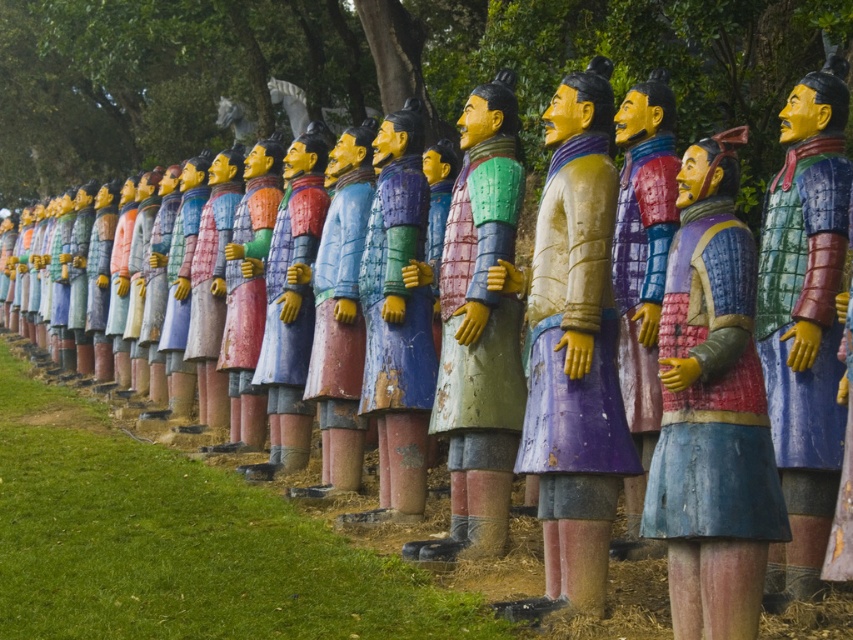
Is wooden figure at center to the left of wooden armor figure at center from the viewer's perspective?

Indeed, wooden figure at center is positioned on the left side of wooden armor figure at center.

Is wooden figure at center bigger than wooden armor figure at center?

Incorrect, wooden figure at center is not larger than wooden armor figure at center.

Which is behind, point (686, 577) or point (793, 522)?

The point (793, 522) is more distant.

The height and width of the screenshot is (640, 853). In order to click on wooden figure at center in this screenshot , I will do `click(712, 412)`.

Is matte blue armor at center positioned in front of matte painted figure at center?

That is True.

Does matte blue armor at center have a greater width compared to matte painted figure at center?

No, matte blue armor at center is not wider than matte painted figure at center.

Who is more distant from viewer, [393,452] or [360,468]?

The point [360,468] is more distant.

The image size is (853, 640). What are the coordinates of `matte blue armor at center` in the screenshot? It's located at (397, 321).

Between matte painted statue at center and matte painted figure at center, which one has less height?

Standing shorter between the two is matte painted figure at center.

Is point (587, 324) behind point (337, 145)?

That is False.

I want to click on matte painted statue at center, so [x=572, y=349].